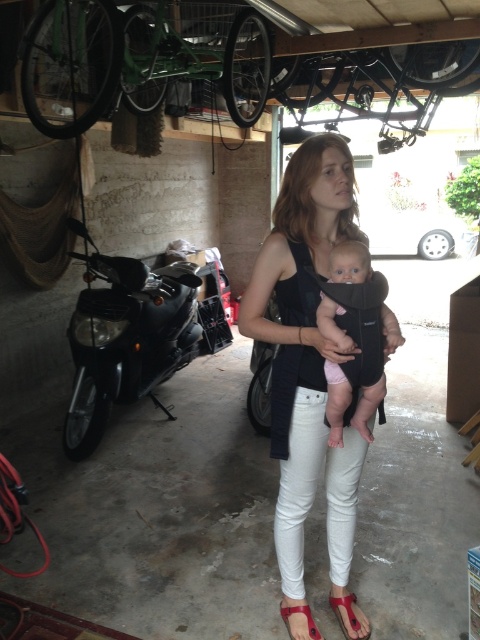
Question: Among these objects, which one is farthest from the camera?

Choices:
 (A) matte red sandal at lower center
 (B) white matte tank top at center
 (C) pink fabric baby at center

Answer: (A)

Question: From the image, what is the correct spatial relationship of black matte motorcycle at left in relation to red leather sandal at lower center?

Choices:
 (A) above
 (B) below

Answer: (A)

Question: Is black matte motorcycle at left positioned behind matte red sandal at lower center?

Choices:
 (A) yes
 (B) no

Answer: (A)

Question: Does matte red sandal at lower center have a greater width compared to red leather sandal at lower center?

Choices:
 (A) yes
 (B) no

Answer: (B)

Question: Which point is closer to the camera?

Choices:
 (A) matte red sandal at lower center
 (B) white matte tank top at center

Answer: (B)

Question: Which of these objects is positioned closest to the red leather sandal at lower center?

Choices:
 (A) matte red sandal at lower center
 (B) pink fabric baby at center
 (C) black matte motorcycle at left
 (D) white matte tank top at center

Answer: (A)